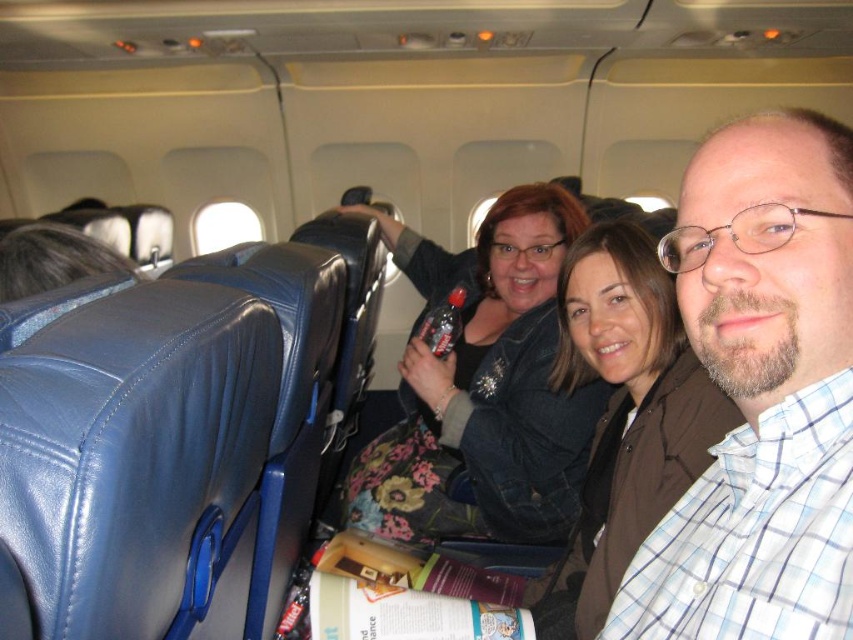
You are a flight attendant checking seat belts. You see the plaid shirt at center and the brown leather jacket at center. Which one is closer to the aisle?

The plaid shirt at center and brown leather jacket at center are 15.53 inches apart, but the description does not specify which is closer to the aisle. Therefore, I cannot determine which is closer based on the provided information.

You are sitting in the airplane cabin and want to reach two points in the scene. The first point is point (440,529) and the second is point (595,358). Which point is closer to you?

Point (440,529) is closer to you because it is further to the camera than point (595,358).